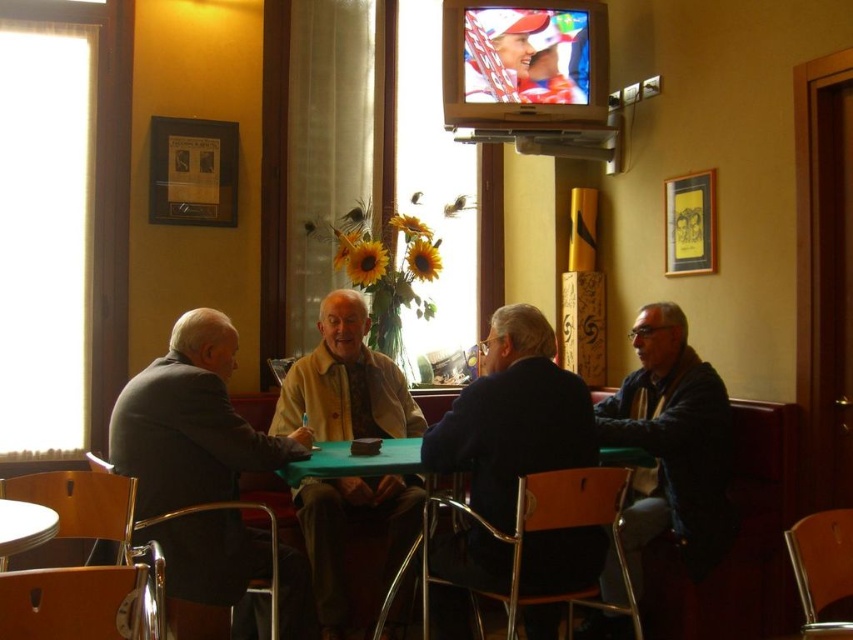
What is the location of the point with coordinates (190,422) in the image?

The point with coordinates (190,422) is located on the dark gray suit at left.

You are a customer entering the cozy indoor setting and notice the dark gray suit at left and the metallic round table at lower left. Which object takes up more space in the scene?

The dark gray suit at left has a larger size compared to the metallic round table at lower left, so it takes up more space in the scene.

You are standing at the entrance of the cafe and want to locate the dark gray suit at left. According to the coordinate system where the bottom left corner is the origin, the point at [190,422] is on the dark gray suit at left. Can you determine the position of the dark gray suit at left relative to the entrance?

The point at [190,422] is on the dark gray suit at left, so the dark gray suit at left is located to the right side of the entrance since the x coordinate is greater than 0.5.